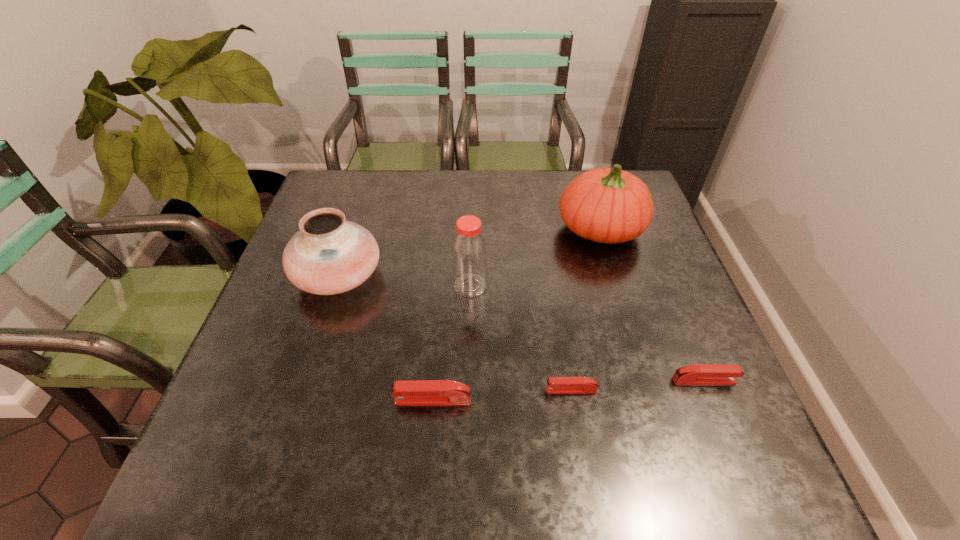
This screenshot has width=960, height=540. Identify the location of stapler that is at the right edge. (698, 374).

The height and width of the screenshot is (540, 960). In order to click on pumpkin located at the right edge in this screenshot , I will do `click(606, 205)`.

This screenshot has width=960, height=540. In order to click on object located in the far right corner section of the desktop in this screenshot , I will do `click(606, 205)`.

In the image, there is a desktop. Find the location of `vacant area at the far edge`. vacant area at the far edge is located at coordinates (539, 193).

The image size is (960, 540). I want to click on free space at the near edge, so click(537, 397).

The width and height of the screenshot is (960, 540). In the image, there is a desktop. Identify the location of vacant space at the left edge. (275, 295).

The width and height of the screenshot is (960, 540). I want to click on free space at the right edge of the desktop, so click(x=664, y=260).

Where is `blank space at the far left corner of the desktop`? blank space at the far left corner of the desktop is located at coordinates (356, 208).

In the image, there is a desktop. At what (x,y) coordinates should I click in order to perform the action: click on vacant space at the near right corner. Please return your answer as a coordinate pair (x, y). The width and height of the screenshot is (960, 540). Looking at the image, I should click on (681, 424).

Locate an element on the screen. This screenshot has width=960, height=540. free point between the second stapler from right to left and the bottle is located at coordinates (520, 338).